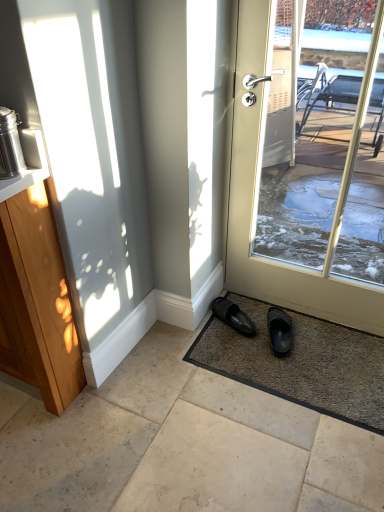
Where is `vacant space positioned to the left of black rubber slipper at lower right, which is the 1th footwear in right-to-left order`? The image size is (384, 512). vacant space positioned to the left of black rubber slipper at lower right, which is the 1th footwear in right-to-left order is located at coordinates (239, 345).